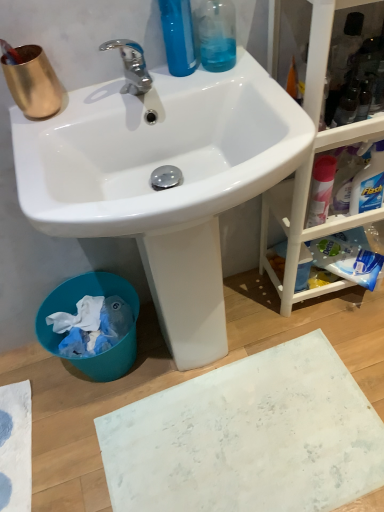
Find the location of a particular element. free space in front of blue plastic trash bin at lower left is located at coordinates (81, 423).